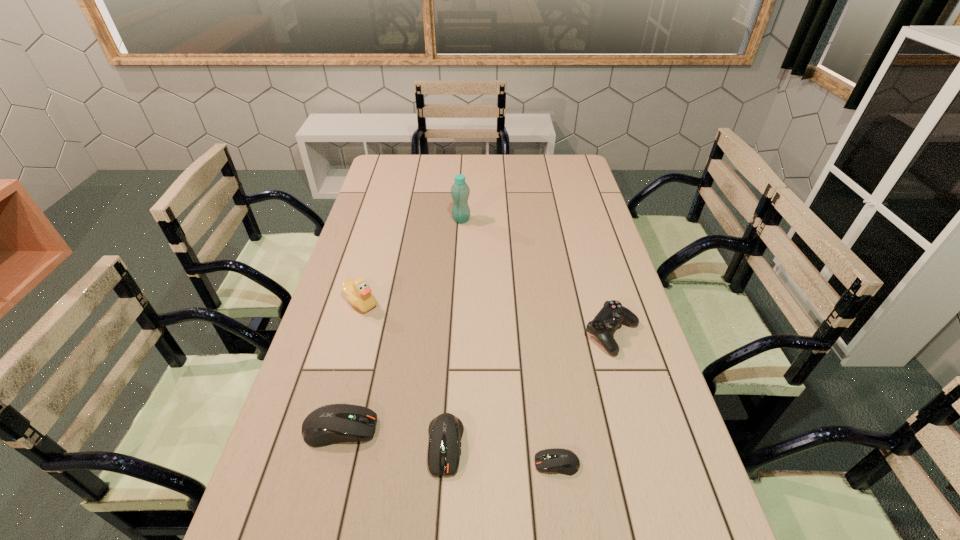
The image size is (960, 540). What are the coordinates of `vacant place for an extra computer equipment on the right` in the screenshot? It's located at (676, 483).